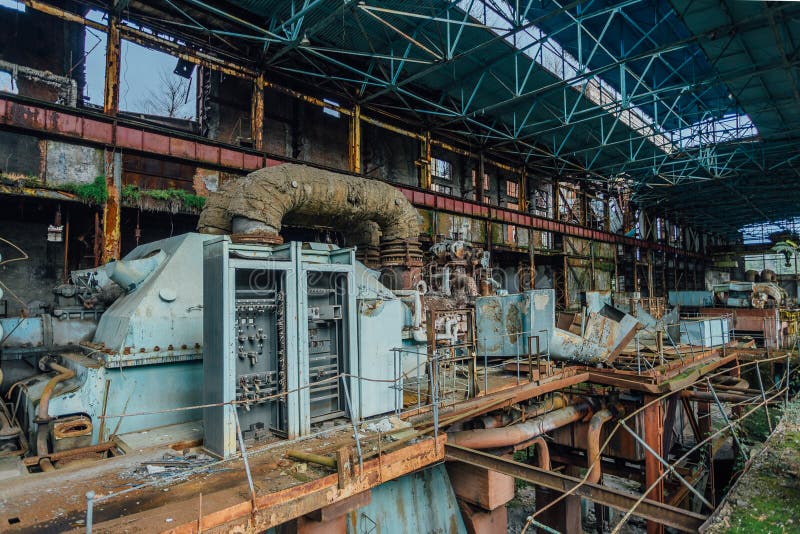
You are a GUI agent. You are given a task and a screenshot of the screen. Output one action in this format:
    pyautogui.click(x=<x>, y=<y>)
    Task: Click on the control panel
    
    Given the screenshot: What is the action you would take?
    coord(268,324), coord(321,326)